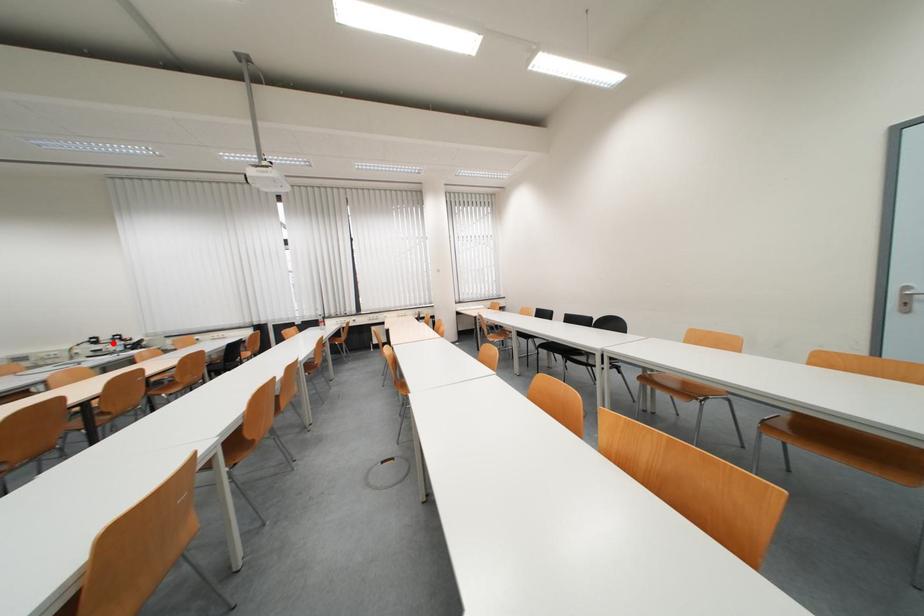
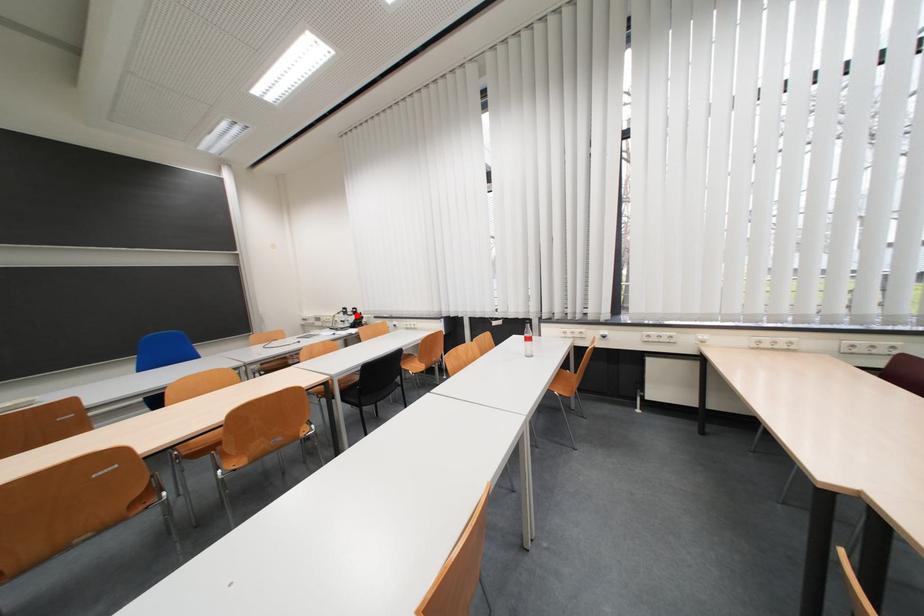
I am providing you with two images of the same scene from different viewpoints. A red point is marked on the first image and another point is marked on the second image. Does the point marked in image1 correspond to the same location as the one in image2?

Yes